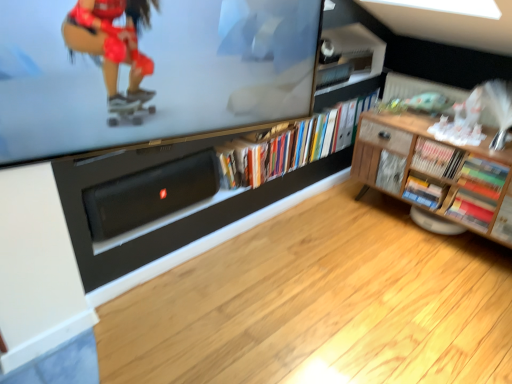
What is the approximate width of multicolored cardboard book at right, the fifth book in the left-to-right sequence?

multicolored cardboard book at right, the fifth book in the left-to-right sequence, is 3.49 inches wide.

Where is `wooden cabinet at right`? wooden cabinet at right is located at coordinates (437, 172).

You are a GUI agent. You are given a task and a screenshot of the screen. Output one action in this format:
    pyautogui.click(x=<x>, y=<y>)
    Task: Click on the hardcover books at center, the fifth book positioned from the right
    Image resolution: width=512 pixels, height=384 pixels.
    Given the screenshot: What is the action you would take?
    pyautogui.click(x=290, y=145)

Find the location of a particular element. multicolored paper book at lower right, acting as the second book starting from the right is located at coordinates (471, 209).

Where is `black matte speaker at lower center`? The width and height of the screenshot is (512, 384). black matte speaker at lower center is located at coordinates pos(150,194).

Which is behind, point (421, 197) or point (443, 158)?

Positioned behind is point (421, 197).

From a real-world perspective, which object stands above the other?

wooden bookshelf at right, the third book when ordered from left to right, from a real-world perspective.

Is hardcover book at center-right, which is counted as the second book, starting from the left, taller or shorter than wooden bookshelf at right, the third book when ordered from left to right?

Clearly, hardcover book at center-right, which is counted as the second book, starting from the left, is shorter compared to wooden bookshelf at right, the third book when ordered from left to right.

What's the angular difference between hardcover book at center-right, the fourth book when ordered from right to left, and wooden bookshelf at right, which appears as the third book when viewed from the right,'s facing directions?

There is a 0.000815-degree angle between the facing directions of hardcover book at center-right, the fourth book when ordered from right to left, and wooden bookshelf at right, which appears as the third book when viewed from the right.

From a real-world perspective, is hardcover books at center, the fifth book positioned from the right, physically located above or below multicolored paper book at lower right, acting as the second book starting from the right?

hardcover books at center, the fifth book positioned from the right, is above multicolored paper book at lower right, acting as the second book starting from the right.

Which of these two, hardcover books at center, the fifth book positioned from the right, or multicolored paper book at lower right, acting as the second book starting from the right, stands shorter?

multicolored paper book at lower right, acting as the second book starting from the right.

Is hardcover books at center, which ranks as the 1th book in left-to-right order, located outside multicolored paper book at lower right, acting as the second book starting from the right?

Yes, hardcover books at center, which ranks as the 1th book in left-to-right order, is located beyond the bounds of multicolored paper book at lower right, acting as the second book starting from the right.

What's the angular difference between hardcover books at center, the fifth book positioned from the right, and multicolored paper book at lower right, which is counted as the fourth book, starting from the left,'s facing directions?

hardcover books at center, the fifth book positioned from the right, and multicolored paper book at lower right, which is counted as the fourth book, starting from the left, are facing 90 degrees away from each other.

From a real-world perspective, is multicolored paper book at lower right, acting as the second book starting from the right, above or below hardcover books at center, the fifth book positioned from the right?

Clearly, from a real-world perspective, multicolored paper book at lower right, acting as the second book starting from the right, is below hardcover books at center, the fifth book positioned from the right.

Is multicolored paper book at lower right, which is counted as the fourth book, starting from the left, oriented away from hardcover books at center, the fifth book positioned from the right?

That's not correct — multicolored paper book at lower right, which is counted as the fourth book, starting from the left, is not looking away from hardcover books at center, the fifth book positioned from the right.

Which point is more forward, (476,215) or (312,160)?

Positioned in front is point (476,215).

Looking at this image, between multicolored paper book at lower right, which is counted as the fourth book, starting from the left, and hardcover books at center, the fifth book positioned from the right, which one has smaller width?

Thinner between the two is multicolored paper book at lower right, which is counted as the fourth book, starting from the left.

Does hardcover books at center, the fifth book positioned from the right, contain wooden cabinet at right?

No, wooden cabinet at right is not a part of hardcover books at center, the fifth book positioned from the right.

Considering the relative positions of hardcover books at center, the fifth book positioned from the right, and wooden cabinet at right in the image provided, is hardcover books at center, the fifth book positioned from the right, to the left or to the right of wooden cabinet at right?

From the image, it's evident that hardcover books at center, the fifth book positioned from the right, is to the left of wooden cabinet at right.

From the image's perspective, is hardcover books at center, which ranks as the 1th book in left-to-right order, beneath wooden cabinet at right?

No.

Is point (233, 155) positioned after point (511, 179)?

Yes, it is.

Is point (450, 157) farther from camera compared to point (461, 147)?

Yes, point (450, 157) is farther from viewer.

From their relative heights in the image, would you say wooden bookshelf at right, the third book when ordered from left to right, is taller or shorter than wooden cabinet at right?

wooden bookshelf at right, the third book when ordered from left to right, is shorter than wooden cabinet at right.

Is wooden cabinet at right a part of wooden bookshelf at right, which appears as the third book when viewed from the right?

No, wooden cabinet at right is not inside wooden bookshelf at right, which appears as the third book when viewed from the right.

From a real-world perspective, count 2nd books upward from the wooden cabinet at right and point to it. Please provide its 2D coordinates.

[(436, 158)]

Does hardcover books at center, which ranks as the 1th book in left-to-right order, turn towards hardcover book at center-right, which is counted as the second book, starting from the left?

Yes, hardcover books at center, which ranks as the 1th book in left-to-right order, is facing hardcover book at center-right, which is counted as the second book, starting from the left.

From the picture: Is hardcover books at center, the fifth book positioned from the right, surrounding hardcover book at center-right, which is counted as the second book, starting from the left?

Actually, hardcover book at center-right, which is counted as the second book, starting from the left, is outside hardcover books at center, the fifth book positioned from the right.

Between hardcover books at center, which ranks as the 1th book in left-to-right order, and hardcover book at center-right, the fourth book when ordered from right to left, which one has smaller size?

hardcover book at center-right, the fourth book when ordered from right to left.

You are a GUI agent. You are given a task and a screenshot of the screen. Output one action in this format:
    pyautogui.click(x=<x>, y=<y>)
    Task: Click on the book that is the 3rd object located above the hardcover book at center-right, which is counted as the second book, starting from the left (from the image's perspective)
    The width and height of the screenshot is (512, 384).
    Given the screenshot: What is the action you would take?
    pyautogui.click(x=290, y=145)

From the image's perspective, is wooden bookshelf at right, which appears as the third book when viewed from the right, positioned above or below hardcover book at center-right, the fourth book when ordered from right to left?

wooden bookshelf at right, which appears as the third book when viewed from the right, is situated higher than hardcover book at center-right, the fourth book when ordered from right to left, in the image.

Does wooden bookshelf at right, the third book when ordered from left to right, appear on the left side of hardcover book at center-right, the fourth book when ordered from right to left?

No.

Between wooden bookshelf at right, the third book when ordered from left to right, and hardcover book at center-right, which is counted as the second book, starting from the left, which one has smaller width?

Thinner between the two is wooden bookshelf at right, the third book when ordered from left to right.

Identify the location of book lying behind the wooden bookshelf at right, the third book when ordered from left to right. This screenshot has width=512, height=384. 424,192.

Identify the location of the 1st book in front of the hardcover books at center, the fifth book positioned from the right. This screenshot has height=384, width=512. (471, 209).

Which object lies nearer to the anchor point hardcover books at center, the fifth book positioned from the right, wooden bookshelf at right, which appears as the third book when viewed from the right, or hardcover book at center-right, which is counted as the second book, starting from the left?

Among the two, wooden bookshelf at right, which appears as the third book when viewed from the right, is located nearer to hardcover books at center, the fifth book positioned from the right.

Looking at the image, which one is located further to multicolored cardboard book at right, the first book when ordered from right to left, hardcover book at center-right, which is counted as the second book, starting from the left, or multicolored paper book at lower right, acting as the second book starting from the right?

hardcover book at center-right, which is counted as the second book, starting from the left.

From the image, which object appears to be farther from black matte speaker at lower center, wooden bookshelf at right, which appears as the third book when viewed from the right, or matte black television at upper center?

wooden bookshelf at right, which appears as the third book when viewed from the right, is positioned further to the anchor black matte speaker at lower center.

Based on their spatial positions, is hardcover books at center, which ranks as the 1th book in left-to-right order, or wooden cabinet at right closer to multicolored cardboard book at right, the first book when ordered from right to left?

The object closer to multicolored cardboard book at right, the first book when ordered from right to left, is wooden cabinet at right.

From the image, which object appears to be nearer to hardcover book at center-right, which is counted as the second book, starting from the left, black matte speaker at lower center or wooden cabinet at right?

wooden cabinet at right.

Based on the photo, based on their spatial positions, is wooden cabinet at right or multicolored paper book at lower right, which is counted as the fourth book, starting from the left, further from multicolored cardboard book at right, the fifth book in the left-to-right sequence?

wooden cabinet at right.

Based on the photo, which object lies further to the anchor point wooden cabinet at right, wooden bookshelf at right, which appears as the third book when viewed from the right, or hardcover books at center, which ranks as the 1th book in left-to-right order?

hardcover books at center, which ranks as the 1th book in left-to-right order, is positioned further to the anchor wooden cabinet at right.

When comparing their distances from hardcover books at center, which ranks as the 1th book in left-to-right order, does hardcover book at center-right, the fourth book when ordered from right to left, or multicolored paper book at lower right, which is counted as the fourth book, starting from the left, seem further?

multicolored paper book at lower right, which is counted as the fourth book, starting from the left, lies further to hardcover books at center, which ranks as the 1th book in left-to-right order, than the other object.

This screenshot has height=384, width=512. Identify the location of book between wooden cabinet at right and multicolored paper book at lower right, acting as the second book starting from the right, from front to back. (483, 177).

What are the coordinates of `television located between black matte speaker at lower center and wooden cabinet at right in the left-right direction` in the screenshot? It's located at point(149,71).

Locate an element on the screen. This screenshot has height=384, width=512. television located between black matte speaker at lower center and multicolored paper book at lower right, acting as the second book starting from the right, in the left-right direction is located at coordinates (149, 71).

The image size is (512, 384). I want to click on book located between black matte speaker at lower center and hardcover book at center-right, the fourth book when ordered from right to left, in the left-right direction, so click(290, 145).